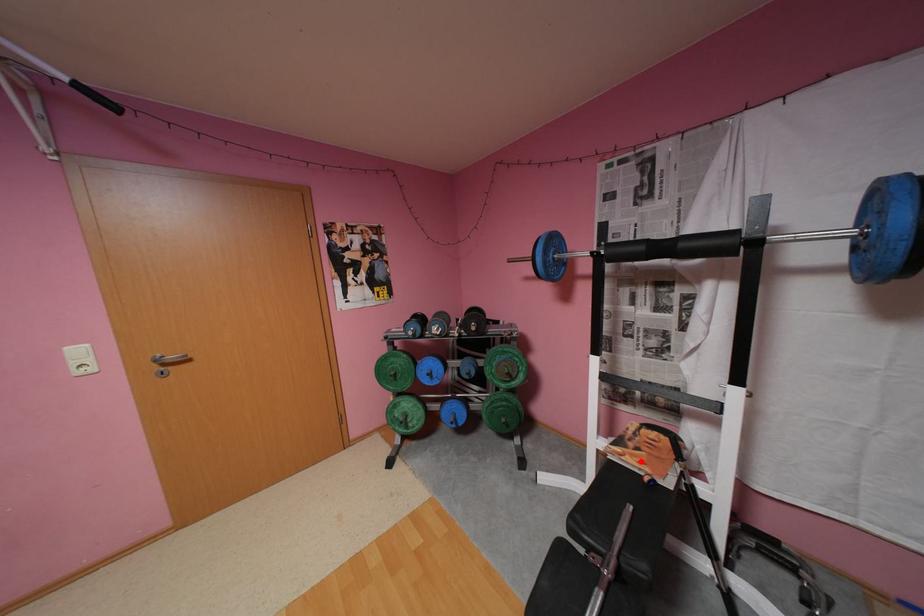
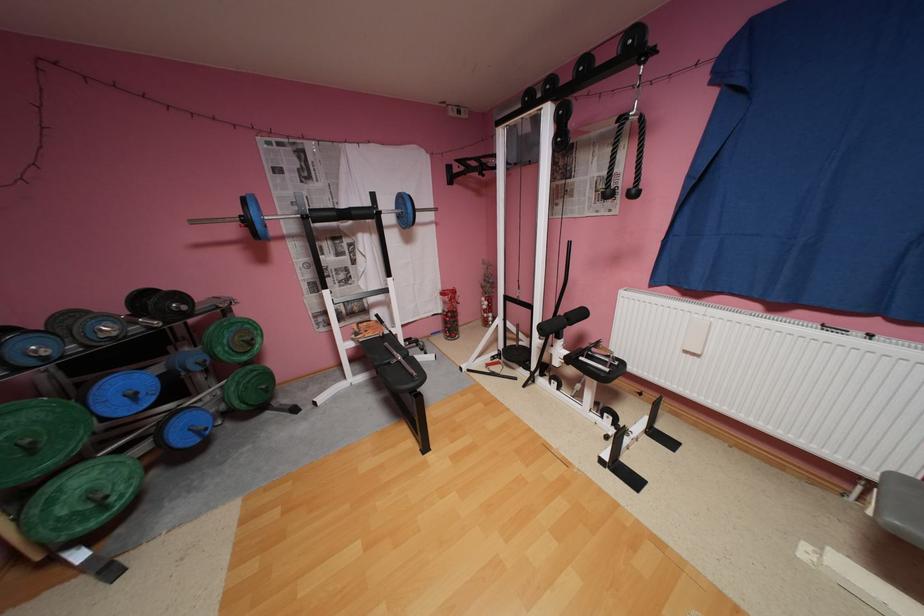
The point at the highlighted location is marked in the first image. Where is the corresponding point in the second image?

(380, 334)